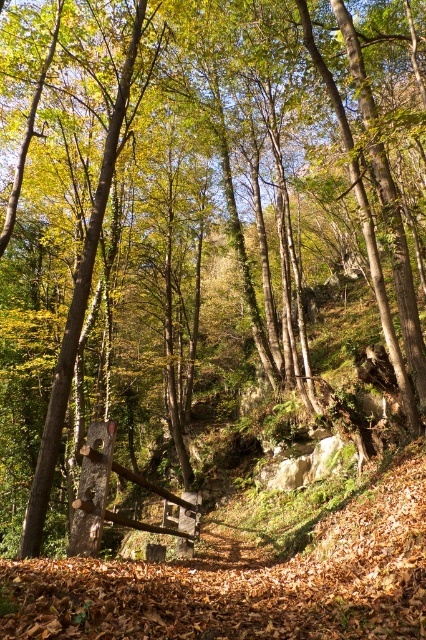
Is brown wood tree at center to the right of wooden log at center from the viewer's perspective?

In fact, brown wood tree at center is to the left of wooden log at center.

Who is higher up, brown wood tree at center or wooden log at center?

Positioned higher is brown wood tree at center.

Who is more distant from viewer, (x=80, y=308) or (x=89, y=548)?

The point (x=80, y=308) is more distant.

In order to click on brown wood tree at center in this screenshot , I will do `click(77, 314)`.